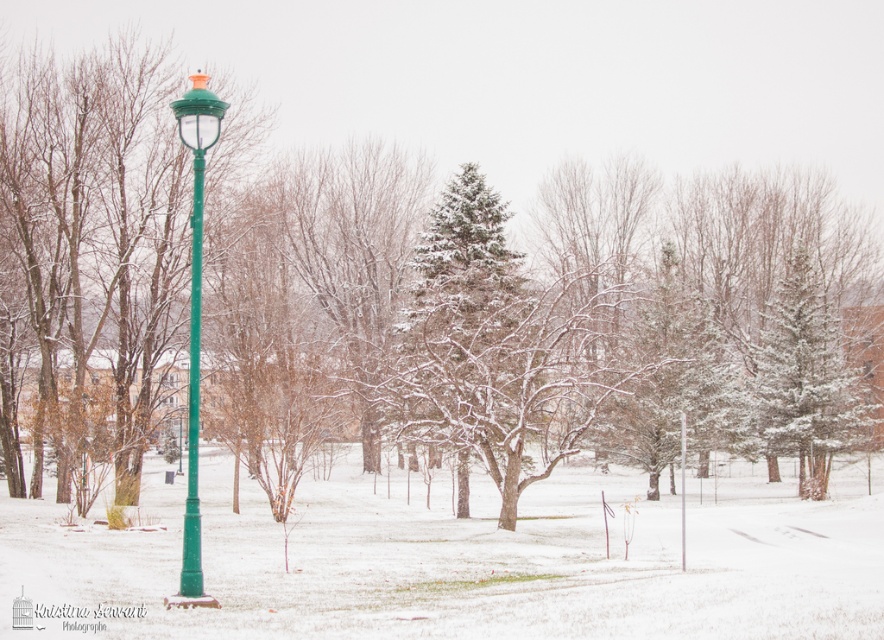
You are standing in the winter park scene and want to reach the green plastic pole at center. Which direction should you move from the green matte pole at left to get there?

You should move towards the center from the green matte pole at left to reach the green plastic pole at center since the green matte pole at left is closer to the viewer than the green plastic pole at center.

You are standing in the winter park scene and want to take a photo. There are two points marked in the image, point A at coordinates point [197,179] and point B at coordinates point [683,531]. Which point is closer to your current position?

Point A at coordinates point [197,179] is closer to your current position because it is closer to the camera than point B at coordinates point [683,531].

You are a maintenance worker checking the spacing between the green matte street light at left and the green matte pole at left. According to safety regulations, the minimum distance between such fixtures should be 18 inches. Is the current spacing compliant with the regulations?

The green matte street light at left is 16.39 inches from the green matte pole at left, which is less than the required 18 inches. Therefore, the spacing does not comply with the safety regulations.